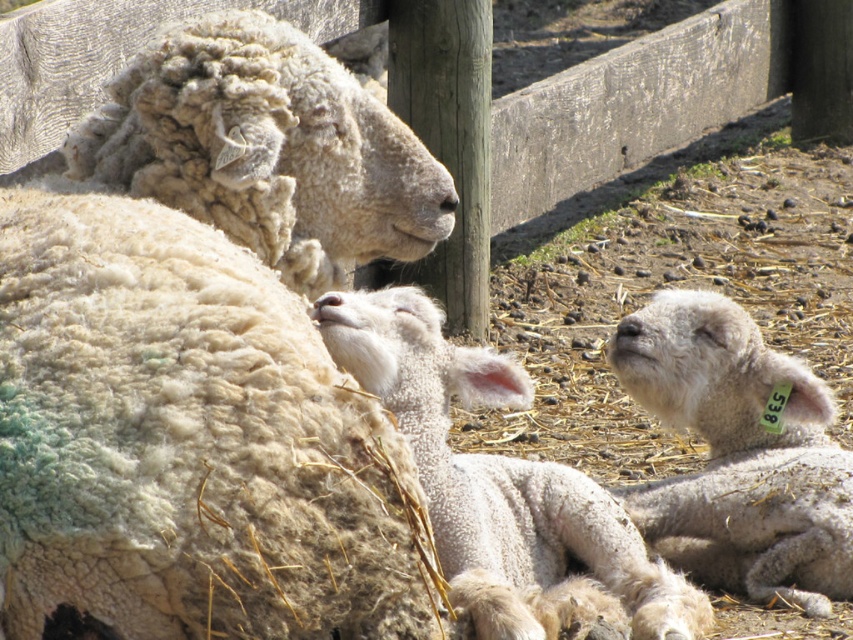
You are a farmer checking the growth of your animals. You notice the white woolen sheep at upper left and the white fluffy lamb at center. Which animal is shorter in height?

The white woolen sheep at upper left is shorter in height compared to the white fluffy lamb at center according to the description.

You are a farmer checking the pasture. You see the white woolen sheep at upper left and the white fluffy lamb at right. Which one is positioned more to the left?

The white woolen sheep at upper left is positioned more to the left than the white fluffy lamb at right.

You are standing at point A located at point (132,348). You want to walk to point B which is 6.70 feet away from you. Is there enough space to walk straight to point B without any obstacles?

The distance between you at point A located at point (132,348) and point B is 6.70 feet, so yes, there is enough space to walk straight to point B without any obstacles since the path is clear.